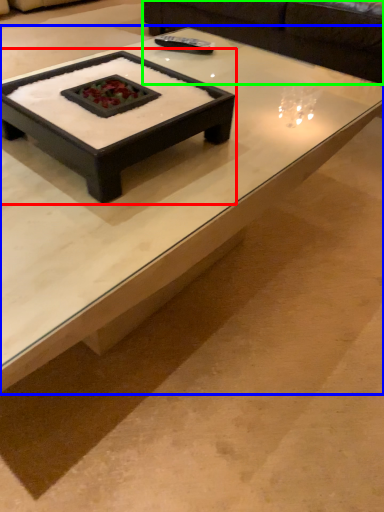
Question: Considering the real-world distances, which object is closest to coffee table (highlighted by a red box)? coffee table (highlighted by a blue box) or couch (highlighted by a green box).

Choices:
 (A) coffee table
 (B) couch

Answer: (A)